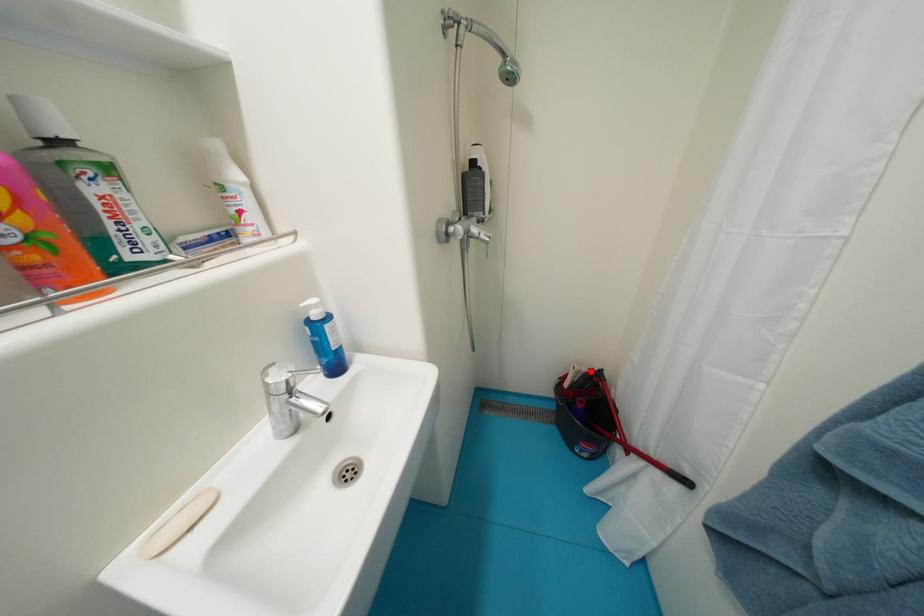
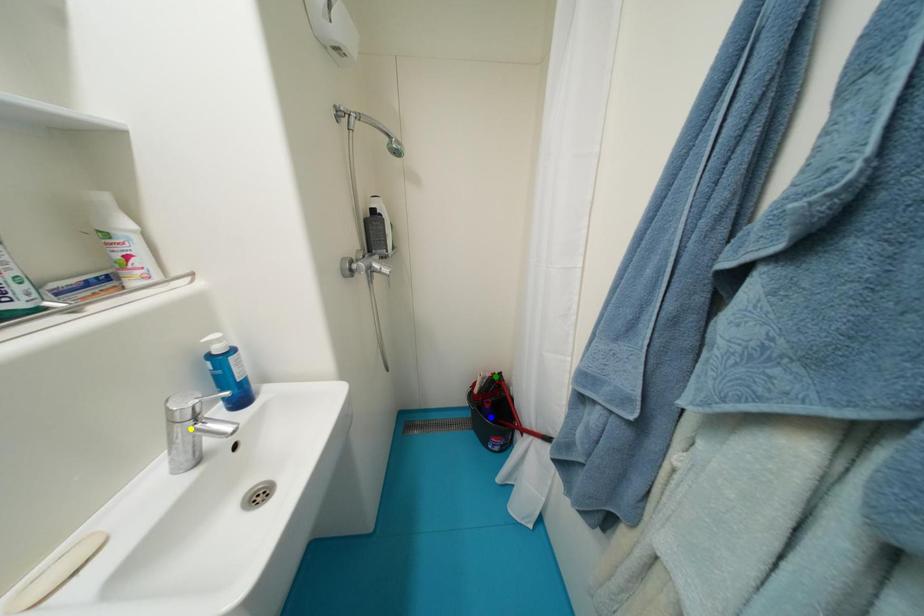
Question: I am providing you with two images of the same scene from different viewpoints. A red point is marked on the first image. You are given multiple points on the second image. Which mark in image 2 goes with the point in image 1?

Choices:
 (A) green point
 (B) blue point
 (C) yellow point

Answer: (A)